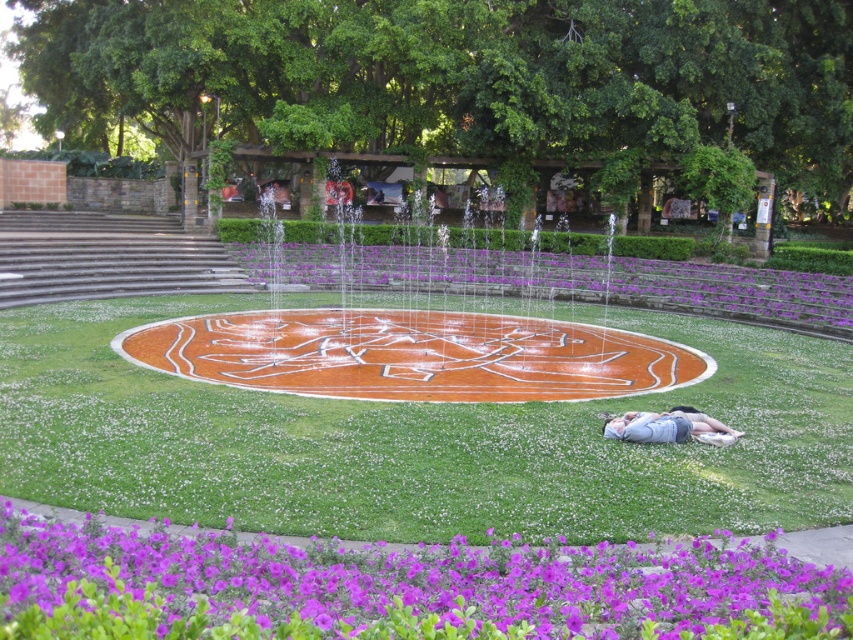
Which is below, purple matte flower at lower left or purple glossy flowers at center?

purple matte flower at lower left is lower down.

Is purple matte flower at lower left below purple glossy flowers at center?

Correct, purple matte flower at lower left is located below purple glossy flowers at center.

Does point (606, 556) lie behind point (281, 252)?

That is False.

Locate an element on the screen. purple matte flower at lower left is located at coordinates (402, 588).

Is point (436, 289) positioned before point (621, 436)?

No, it is behind (621, 436).

Between point (346, 276) and point (734, 438), which one is positioned in front?

Point (734, 438)

Is point (502, 291) positioned after point (677, 440)?

Yes, point (502, 291) is behind point (677, 440).

The image size is (853, 640). What are the coordinates of `purple glossy flowers at center` in the screenshot? It's located at (561, 280).

Does point (479, 360) come closer to viewer compared to point (805, 312)?

That is True.

Is orange polished stone fountain at center wider than purple glossy flowers at center?

In fact, orange polished stone fountain at center might be narrower than purple glossy flowers at center.

What do you see at coordinates (413, 355) in the screenshot? Image resolution: width=853 pixels, height=640 pixels. I see `orange polished stone fountain at center` at bounding box center [413, 355].

This screenshot has width=853, height=640. In order to click on orange polished stone fountain at center in this screenshot , I will do `click(413, 355)`.